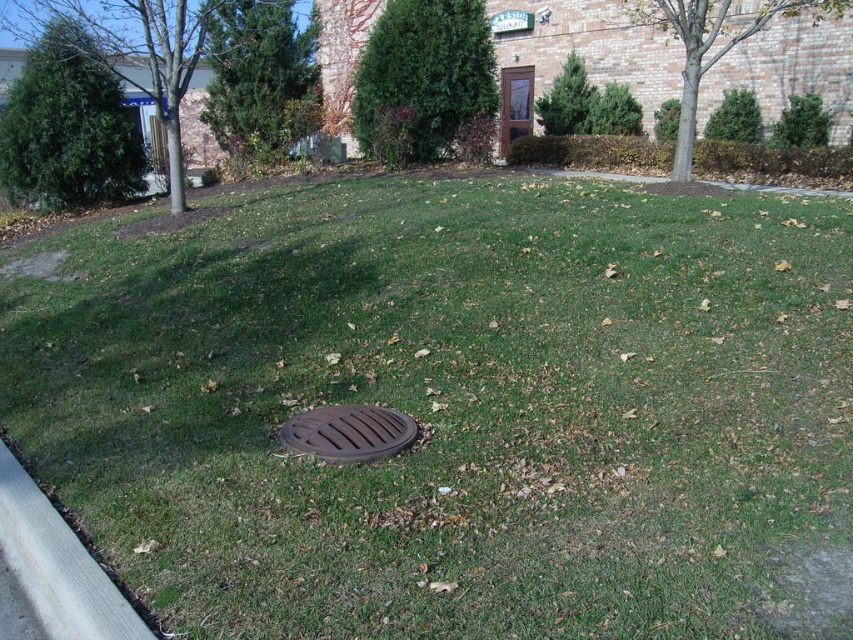
Which is more to the right, gray concrete curb at lower left or brown matte manhole cover at center?

brown matte manhole cover at center is more to the right.

You are a GUI agent. You are given a task and a screenshot of the screen. Output one action in this format:
    pyautogui.click(x=<x>, y=<y>)
    Task: Click on the gray concrete curb at lower left
    
    Given the screenshot: What is the action you would take?
    pyautogui.click(x=57, y=564)

Is green grass at center smaller than brown matte manhole cover at center?

Incorrect, green grass at center is not smaller in size than brown matte manhole cover at center.

Does point (289, 253) lie in front of point (375, 428)?

No.

This screenshot has width=853, height=640. What do you see at coordinates (451, 408) in the screenshot?
I see `green grass at center` at bounding box center [451, 408].

This screenshot has width=853, height=640. Identify the location of green grass at center. (451, 408).

Is point (421, 412) less distant than point (84, 564)?

That is False.

Does point (645, 458) come closer to viewer compared to point (51, 632)?

No, it is behind (51, 632).

Locate an element on the screen. The height and width of the screenshot is (640, 853). green grass at center is located at coordinates (451, 408).